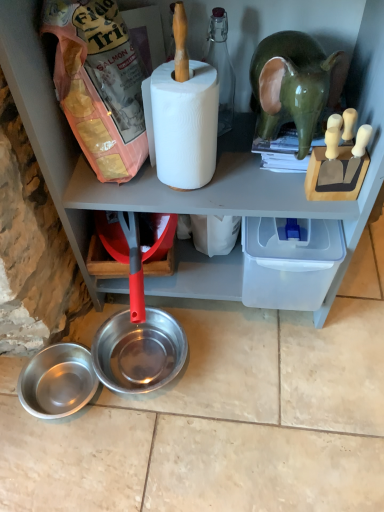
Identify the location of vacant region under shiny metallic bowl at lower center, which is counted as the 2th bowl, starting from the left (from a real-world perspective). The image size is (384, 512). (151, 364).